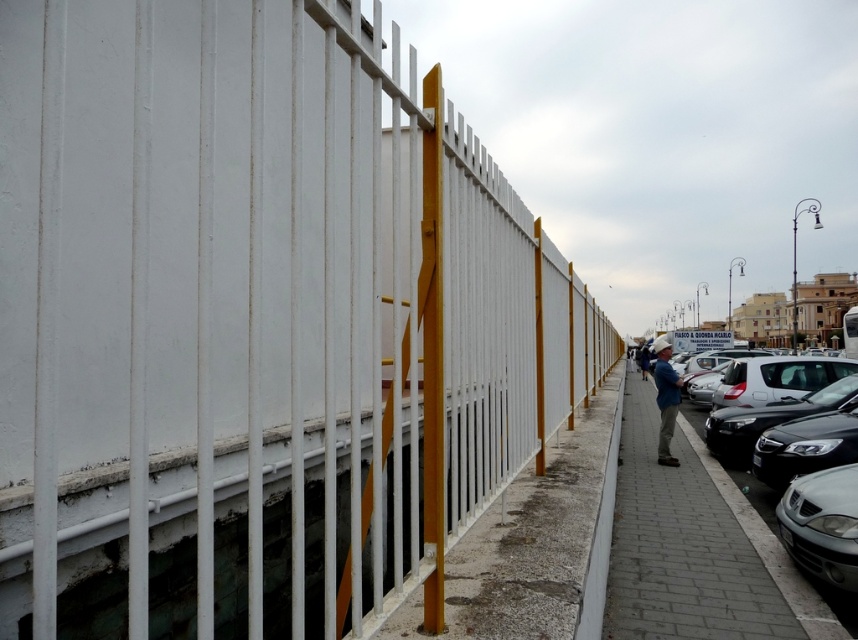
You are a delivery person trying to navigate a narrow path between the white plastic fence at center and the gray concrete sidewalk at center. Which side should you walk on to stay closer to the sidewalk?

You should walk on the gray concrete sidewalk at center since the white plastic fence at center is positioned to its left side, keeping you closer to the sidewalk.

You are standing on the sidewalk next to the tall white fence. You see the concrete at center and the matte silver car at lower right. Which object is taller from your perspective?

The matte silver car at lower right is taller than the concrete at center.

You are standing on the sidewalk and want to cross the street. The concrete at center is in your path. Can you see the matte silver car at lower right from your current position?

The matte silver car at lower right is behind the concrete at center, so it is obstructed from view. Therefore, you cannot see the matte silver car at lower right from your current position.